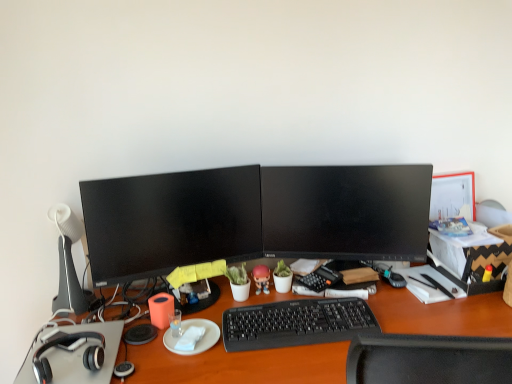
Locate an element on the screen. free space in front of orange matte tissue at center is located at coordinates (172, 365).